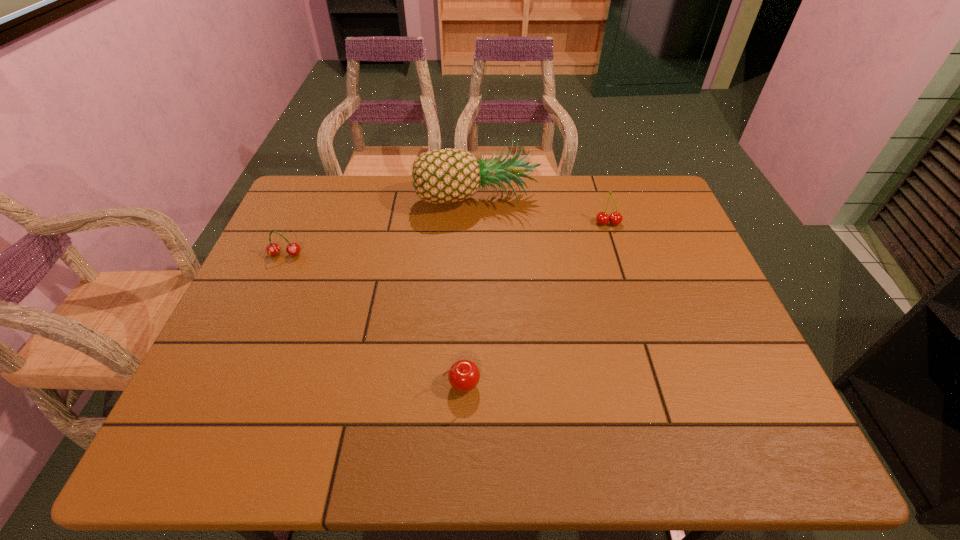
Locate an element on the screen. This screenshot has height=540, width=960. the tallest object is located at coordinates (448, 175).

Image resolution: width=960 pixels, height=540 pixels. In order to click on the rightmost cherry in this screenshot , I will do `click(602, 218)`.

In order to click on the rightmost object in this screenshot , I will do `click(602, 218)`.

The image size is (960, 540). I want to click on the leftmost cherry, so click(x=272, y=249).

Locate an element on the screen. This screenshot has height=540, width=960. the third farthest object is located at coordinates (272, 249).

Locate an element on the screen. the nearest cherry is located at coordinates (463, 375).

At what (x,y) coordinates should I click in order to perform the action: click on the nearest object. Please return your answer as a coordinate pair (x, y). This screenshot has height=540, width=960. Looking at the image, I should click on (463, 375).

You are a GUI agent. You are given a task and a screenshot of the screen. Output one action in this format:
    pyautogui.click(x=<x>, y=<y>)
    Task: Click on the free space located on the left of the tallest object
    
    Given the screenshot: What is the action you would take?
    pyautogui.click(x=389, y=197)

Where is `vacant space located 0.170m with the stems of the rightmost cherry pointing upwards`? This screenshot has width=960, height=540. vacant space located 0.170m with the stems of the rightmost cherry pointing upwards is located at coordinates (622, 268).

The height and width of the screenshot is (540, 960). Identify the location of free spot located 0.120m with stems pointing upwards on the second farthest cherry. (269, 292).